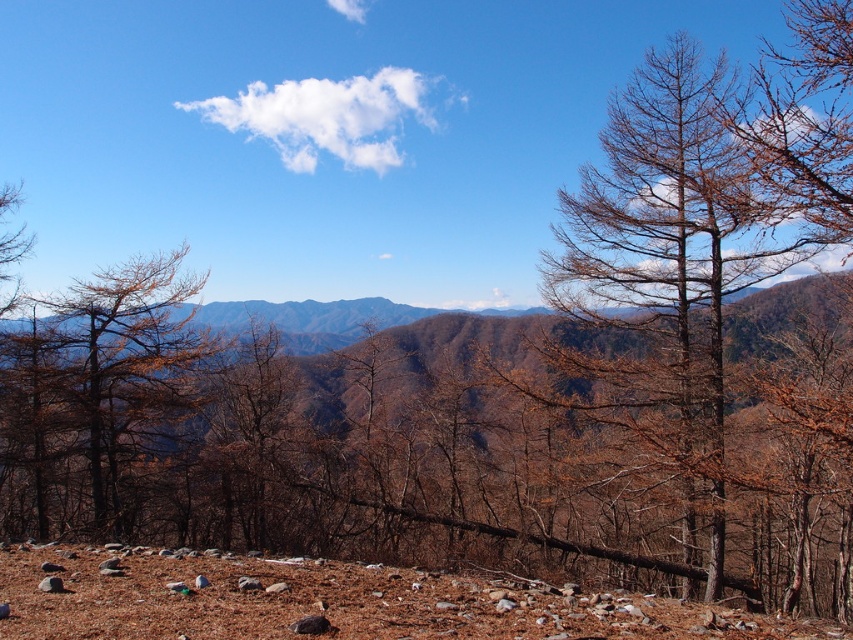
Question: Among these objects, which one is farthest from the camera?

Choices:
 (A) brown matte tree at left
 (B) brown/dried bark tree at right

Answer: (A)

Question: Can you confirm if brown/dried bark tree at right is smaller than brown matte tree at left?

Choices:
 (A) no
 (B) yes

Answer: (A)

Question: Is brown/dried bark tree at right wider than brown matte tree at left?

Choices:
 (A) yes
 (B) no

Answer: (A)

Question: Which of the following is the closest to the observer?

Choices:
 (A) brown matte tree at left
 (B) brown/dried bark tree at right

Answer: (B)

Question: Is brown/dried bark tree at right wider than brown matte tree at left?

Choices:
 (A) yes
 (B) no

Answer: (A)